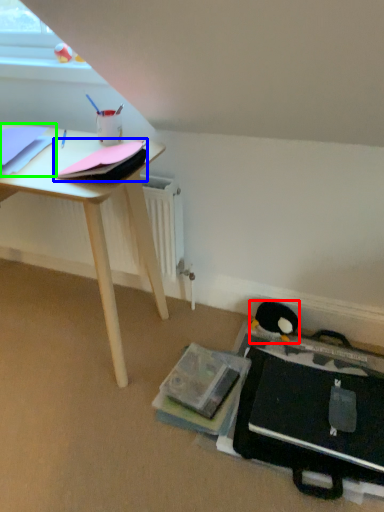
Question: Based on their relative distances, which object is farther from penguin (highlighted by a red box)? Choose from paperback book (highlighted by a blue box) and paperback book (highlighted by a green box).

Choices:
 (A) paperback book
 (B) paperback book

Answer: (B)